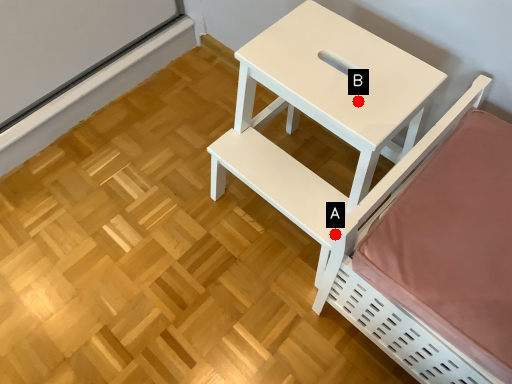
Question: Two points are circled on the image, labeled by A and B beside each circle. Which point appears farthest from the camera in this image?

Choices:
 (A) A is further
 (B) B is further

Answer: (B)